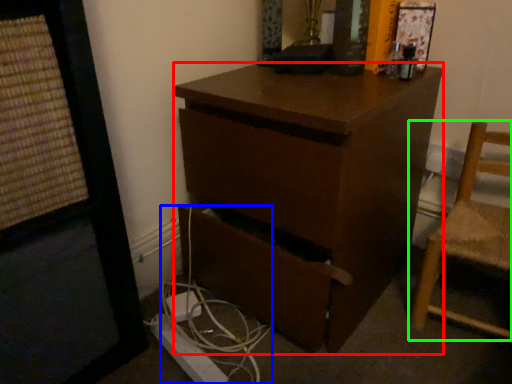
Question: Which is nearer to the desk (highlighted by a red box)? cable (highlighted by a blue box) or chair (highlighted by a green box).

Choices:
 (A) cable
 (B) chair

Answer: (A)